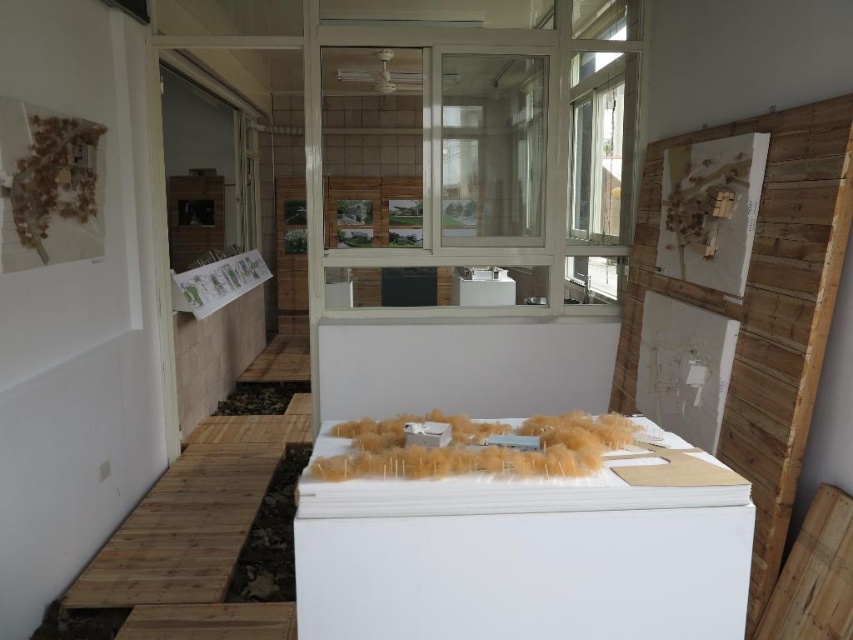
Question: Is white foam model at center further to camera compared to white glossy refrigerator at center?

Choices:
 (A) yes
 (B) no

Answer: (B)

Question: Is white foam model at center below white glossy refrigerator at center?

Choices:
 (A) no
 (B) yes

Answer: (B)

Question: Which object is farther from the camera taking this photo?

Choices:
 (A) white foam model at center
 (B) white glossy refrigerator at center

Answer: (B)

Question: Which of the following is the farthest from the observer?

Choices:
 (A) white foam model at center
 (B) white glossy refrigerator at center

Answer: (B)

Question: Is white foam model at center bigger than white glossy refrigerator at center?

Choices:
 (A) no
 (B) yes

Answer: (B)